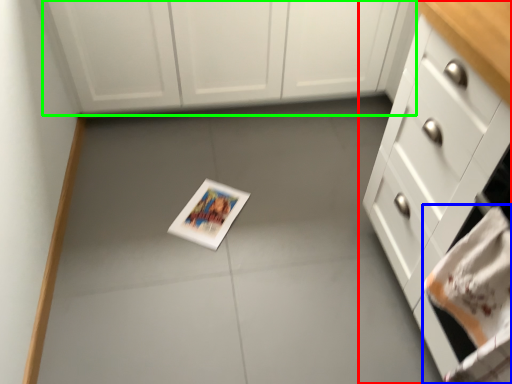
Question: Estimate the real-world distances between objects in this image. Which object is farther from cabinetry (highlighted by a red box), hand towel (highlighted by a blue box) or cabinetry (highlighted by a green box)?

Choices:
 (A) hand towel
 (B) cabinetry

Answer: (B)